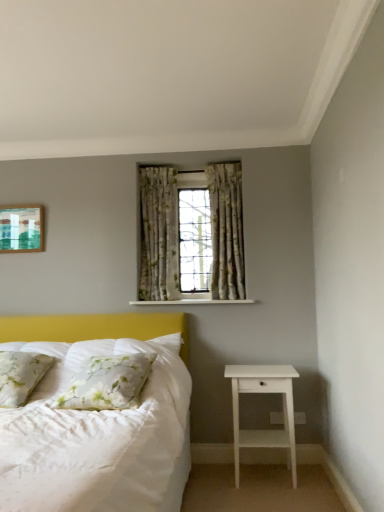
Find the location of a particular element. This screenshot has width=384, height=512. floral fabric curtain at center, which is the second curtain in left-to-right order is located at coordinates (226, 230).

I want to click on green floral fabric curtain at center, the 2th curtain positioned from the right, so click(158, 233).

The height and width of the screenshot is (512, 384). What do you see at coordinates (21, 228) in the screenshot? I see `matte green painting at upper left` at bounding box center [21, 228].

This screenshot has width=384, height=512. Find the location of `floral fabric curtain at center, the first curtain in the right-to-left sequence`. floral fabric curtain at center, the first curtain in the right-to-left sequence is located at coordinates (226, 230).

Consider the image. Is matte green painting at upper left looking in the opposite direction of floral fabric curtains at center?

No, floral fabric curtains at center is not at the back of matte green painting at upper left.

Which of these two, matte green painting at upper left or floral fabric curtains at center, stands taller?

With more height is floral fabric curtains at center.

Is matte green painting at upper left positioned far away from floral fabric curtains at center?

Yes, matte green painting at upper left and floral fabric curtains at center are located far from each other.

Which object is wider, matte green painting at upper left or floral fabric curtains at center?

floral fabric curtains at center is wider.

Considering the sizes of floral fabric curtains at center and floral fabric pillow at left, the 1th pillow in the left-to-right sequence, in the image, is floral fabric curtains at center wider or thinner than floral fabric pillow at left, the 1th pillow in the left-to-right sequence,?

In the image, floral fabric curtains at center appears to be more narrow than floral fabric pillow at left, the 1th pillow in the left-to-right sequence.

From the picture: Would you say floral fabric curtains at center is inside or outside floral fabric pillow at left, the 1th pillow in the left-to-right sequence?

floral fabric curtains at center is not enclosed by floral fabric pillow at left, the 1th pillow in the left-to-right sequence.

Can you confirm if floral fabric curtains at center is taller than floral fabric pillow at left, the second pillow when ordered from right to left?

Yes, floral fabric curtains at center is taller than floral fabric pillow at left, the second pillow when ordered from right to left.

From a real-world perspective, is floral fabric curtains at center beneath floral fabric pillow at left, the 1th pillow in the left-to-right sequence?

Incorrect, from a real-world perspective, floral fabric curtains at center is higher than floral fabric pillow at left, the 1th pillow in the left-to-right sequence.

Is floral fabric curtain at center, the first curtain in the right-to-left sequence, positioned with its back to white floral pillow at lower left, which is counted as the 2th pillow, starting from the left?

floral fabric curtain at center, the first curtain in the right-to-left sequence, does not have its back to white floral pillow at lower left, which is counted as the 2th pillow, starting from the left.

Between floral fabric curtain at center, the first curtain in the right-to-left sequence, and white floral pillow at lower left, which is counted as the 2th pillow, starting from the left, which one has smaller size?

white floral pillow at lower left, which is counted as the 2th pillow, starting from the left.

From a real-world perspective, is floral fabric curtain at center, the first curtain in the right-to-left sequence, above or below white floral pillow at lower left, acting as the 1th pillow starting from the right?

In terms of real-world spatial position, floral fabric curtain at center, the first curtain in the right-to-left sequence, is above white floral pillow at lower left, acting as the 1th pillow starting from the right.

Looking at this image, which object is more forward, floral fabric curtain at center, the first curtain in the right-to-left sequence, or white floral pillow at lower left, which is counted as the 2th pillow, starting from the left?

white floral pillow at lower left, which is counted as the 2th pillow, starting from the left, is in front.

Is floral fabric curtains at center completely or partially outside of green floral fabric curtain at center, the 2th curtain positioned from the right?

Absolutely, floral fabric curtains at center is external to green floral fabric curtain at center, the 2th curtain positioned from the right.

Considering the sizes of objects floral fabric curtains at center and green floral fabric curtain at center, which is the 1th curtain in left-to-right order, in the image provided, who is wider, floral fabric curtains at center or green floral fabric curtain at center, which is the 1th curtain in left-to-right order,?

Wider between the two is floral fabric curtains at center.

In the scene shown: From the image's perspective, is floral fabric curtains at center beneath green floral fabric curtain at center, the 2th curtain positioned from the right?

No.

How different are the orientations of floral fabric curtains at center and green floral fabric curtain at center, the 2th curtain positioned from the right, in degrees?

The angle between the facing direction of floral fabric curtains at center and the facing direction of green floral fabric curtain at center, the 2th curtain positioned from the right, is 1.1 degrees.

From the image's perspective, is white floral pillow at lower left, which is counted as the 2th pillow, starting from the left, located beneath white painted wood at center?

Yes.

Is white floral pillow at lower left, which is counted as the 2th pillow, starting from the left, turned away from white painted wood at center?

No, white floral pillow at lower left, which is counted as the 2th pillow, starting from the left, is not facing the opposite direction of white painted wood at center.

There is a white painted wood at center. At what (x,y) coordinates should I click in order to perform the action: click on the 1st pillow below it (from the image's perspective). Please return your answer as a coordinate pair (x, y). Looking at the image, I should click on click(107, 382).

From a real-world perspective, relative to white painted wood at center, is white floral pillow at lower left, acting as the 1th pillow starting from the right, vertically above or below?

white floral pillow at lower left, acting as the 1th pillow starting from the right, is below white painted wood at center.

Does floral fabric curtains at center touch floral fabric curtain at center, the first curtain in the right-to-left sequence?

There is a gap between floral fabric curtains at center and floral fabric curtain at center, the first curtain in the right-to-left sequence.

Can we say floral fabric curtains at center lies outside floral fabric curtain at center, the first curtain in the right-to-left sequence?

floral fabric curtains at center lies outside floral fabric curtain at center, the first curtain in the right-to-left sequence,'s area.

In the scene shown: Which object is closer to the camera taking this photo, floral fabric curtains at center or floral fabric curtain at center, the first curtain in the right-to-left sequence?

floral fabric curtains at center is closer to the camera.

In the scene shown: Considering the relative sizes of floral fabric curtains at center and floral fabric curtain at center, which is the second curtain in left-to-right order, in the image provided, is floral fabric curtains at center bigger than floral fabric curtain at center, which is the second curtain in left-to-right order,?

Yes.

Is floral fabric curtains at center facing away from white painted wood at center?

No, floral fabric curtains at center's orientation is not away from white painted wood at center.

Who is bigger, floral fabric curtains at center or white painted wood at center?

Bigger between the two is floral fabric curtains at center.

The image size is (384, 512). What are the coordinates of `window above the white painted wood at center (from a real-world perspective)` in the screenshot? It's located at (192, 234).

Considering the relative positions of floral fabric curtains at center and white painted wood at center in the image provided, is floral fabric curtains at center to the left or to the right of white painted wood at center?

floral fabric curtains at center is positioned on white painted wood at center's left side.

Locate an element on the screen. This screenshot has height=512, width=384. picture frame above the floral fabric curtains at center (from the image's perspective) is located at coordinates (21, 228).

Where is `pillow that is the 1st one when counting forward from the floral fabric curtains at center`? pillow that is the 1st one when counting forward from the floral fabric curtains at center is located at coordinates (21, 375).

Which object lies further to the anchor point white painted wood at center, white floral pillow at lower left, which is counted as the 2th pillow, starting from the left, or matte green painting at upper left?

The object further to white painted wood at center is matte green painting at upper left.

Looking at the image, which one is located closer to floral fabric curtain at center, which is the second curtain in left-to-right order, white painted wood at center or white floral pillow at lower left, which is counted as the 2th pillow, starting from the left?

Among the two, white painted wood at center is located nearer to floral fabric curtain at center, which is the second curtain in left-to-right order.

In the scene shown: Looking at the image, which one is located closer to floral fabric curtains at center, green floral fabric curtain at center, which is the 1th curtain in left-to-right order, or floral fabric curtain at center, which is the second curtain in left-to-right order?

green floral fabric curtain at center, which is the 1th curtain in left-to-right order, is positioned closer to the anchor floral fabric curtains at center.

Which object lies further to the anchor point white matte nightstand at lower right, matte green painting at upper left or white painted wood at center?

matte green painting at upper left lies further to white matte nightstand at lower right than the other object.

Looking at the image, which one is located closer to floral fabric pillow at left, the 1th pillow in the left-to-right sequence, floral fabric curtains at center or green floral fabric curtain at center, the 2th curtain positioned from the right?

green floral fabric curtain at center, the 2th curtain positioned from the right.

From the image, which object appears to be nearer to floral fabric curtain at center, the first curtain in the right-to-left sequence, green floral fabric curtain at center, the 2th curtain positioned from the right, or white painted wood at center?

The object closer to floral fabric curtain at center, the first curtain in the right-to-left sequence, is green floral fabric curtain at center, the 2th curtain positioned from the right.

From the image, which object appears to be nearer to green floral fabric curtain at center, which is the 1th curtain in left-to-right order, white painted wood at center or floral fabric curtain at center, which is the second curtain in left-to-right order?

floral fabric curtain at center, which is the second curtain in left-to-right order.

Looking at the image, which one is located further to floral fabric curtain at center, the first curtain in the right-to-left sequence, white matte nightstand at lower right or matte green painting at upper left?

The object further to floral fabric curtain at center, the first curtain in the right-to-left sequence, is matte green painting at upper left.

The image size is (384, 512). What are the coordinates of `window sill between floral fabric curtain at center, the first curtain in the right-to-left sequence, and white matte nightstand at lower right in the up-down direction` in the screenshot? It's located at (193, 302).

Locate an element on the screen. window between floral fabric pillow at left, the 1th pillow in the left-to-right sequence, and floral fabric curtain at center, which is the second curtain in left-to-right order, from left to right is located at coordinates (192, 234).

You are a GUI agent. You are given a task and a screenshot of the screen. Output one action in this format:
    pyautogui.click(x=<x>, y=<y>)
    Task: Click on the pillow located between floral fabric pillow at left, the 1th pillow in the left-to-right sequence, and white painted wood at center in the left-right direction
    This screenshot has height=512, width=384.
    Given the screenshot: What is the action you would take?
    pyautogui.click(x=107, y=382)

Where is `window sill located between matte green painting at upper left and floral fabric curtain at center, the first curtain in the right-to-left sequence, in the left-right direction`? The width and height of the screenshot is (384, 512). window sill located between matte green painting at upper left and floral fabric curtain at center, the first curtain in the right-to-left sequence, in the left-right direction is located at coordinates (193, 302).